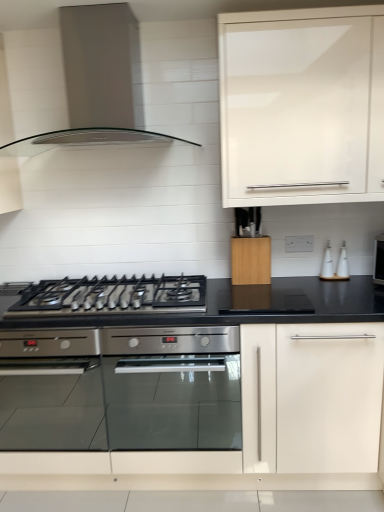
Find the location of a particular element. The width and height of the screenshot is (384, 512). vacant space underneath satin metallic range hood at upper center (from a real-world perspective) is located at coordinates (126, 283).